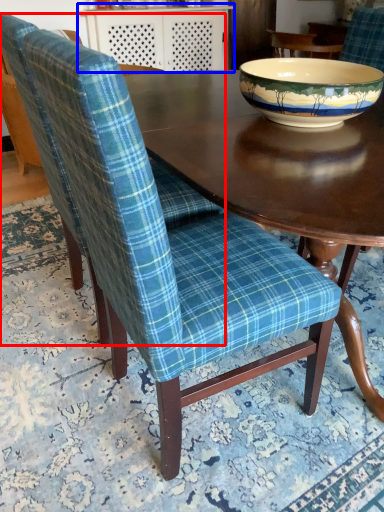
Question: Which object is further to the camera taking this photo, chair (highlighted by a red box) or table (highlighted by a blue box)?

Choices:
 (A) chair
 (B) table

Answer: (B)